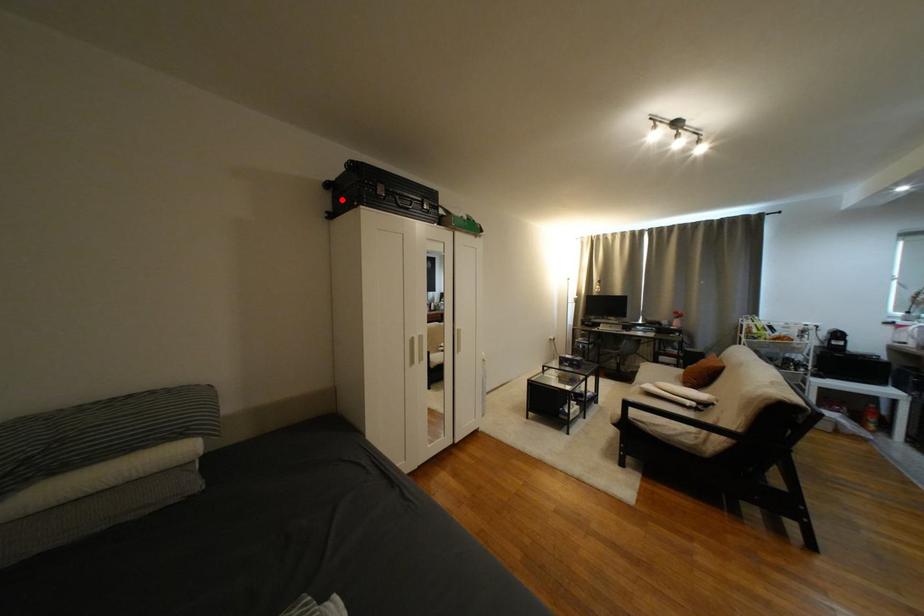
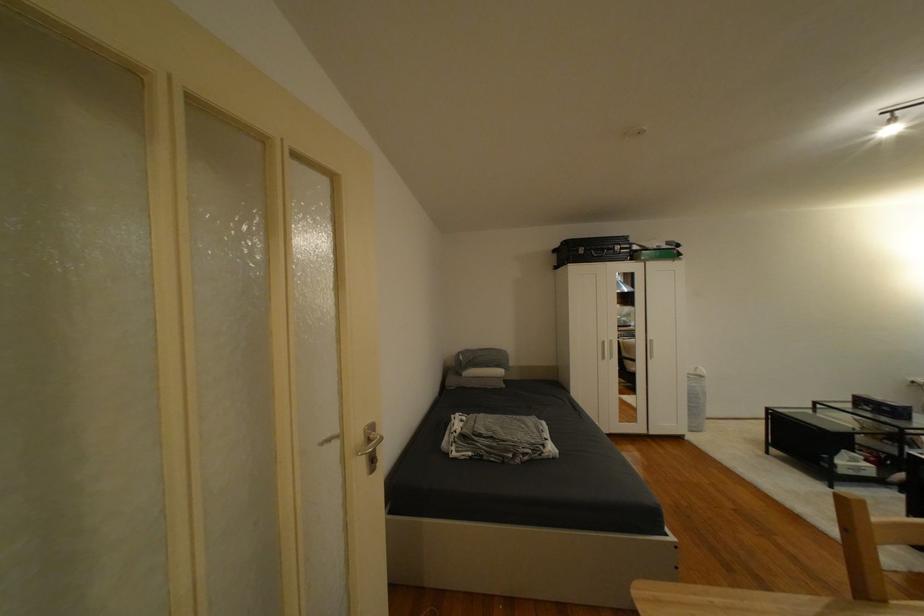
In the second image, find the point that corresponds to the highlighted location in the first image.

(565, 257)